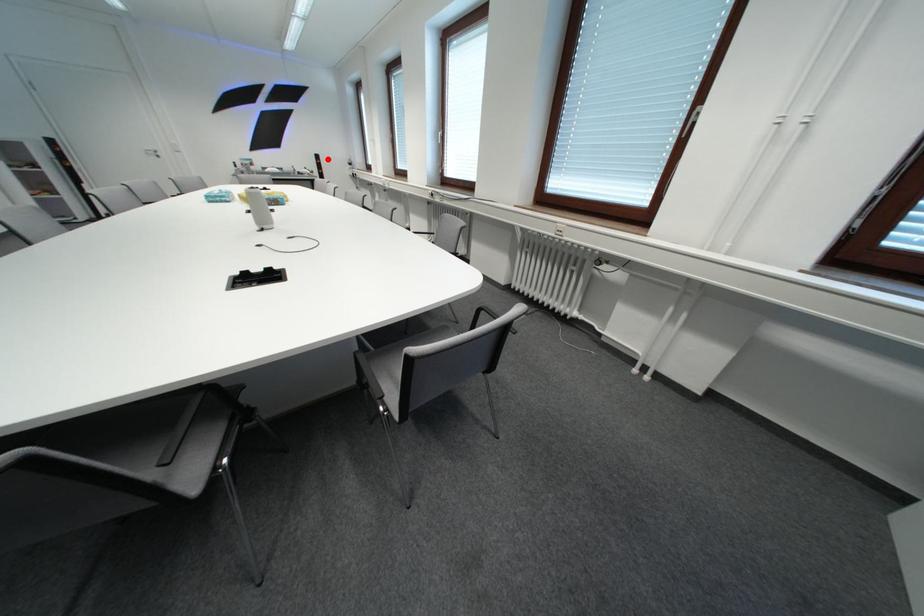
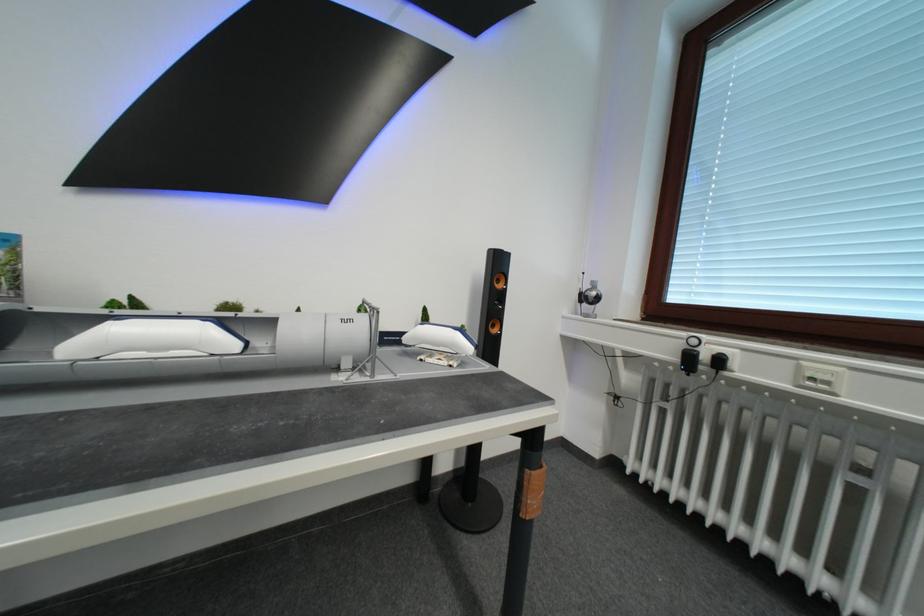
Question: I am providing you with two images of the same scene from different viewpoints. A red point is marked on the first image. Can you still see the location of the red point in image 2?

Choices:
 (A) Yes
 (B) No

Answer: (A)